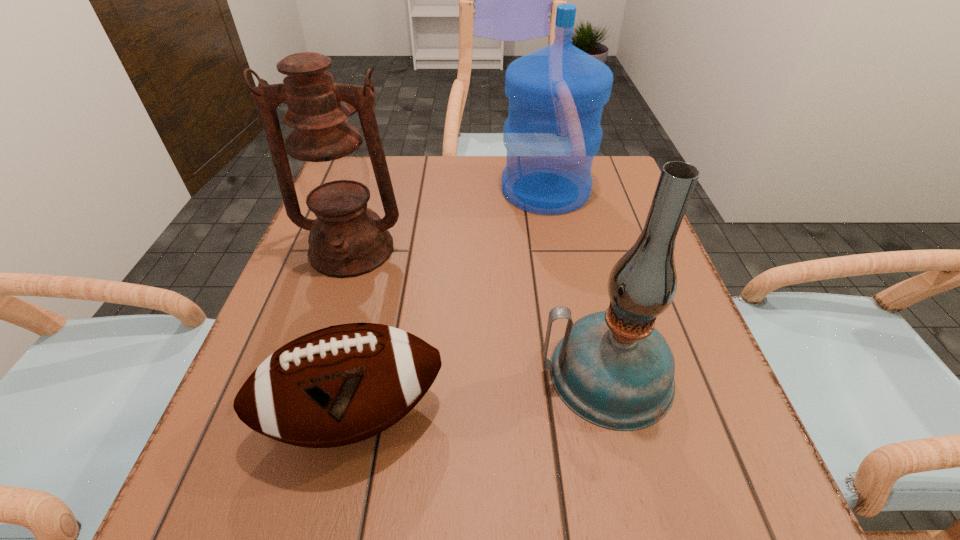
This screenshot has width=960, height=540. Find the location of `object positioned at the near edge`. object positioned at the near edge is located at coordinates (339, 385).

You are a GUI agent. You are given a task and a screenshot of the screen. Output one action in this format:
    pyautogui.click(x=<x>, y=<y>)
    Task: Click on the oil lamp present at the left edge
    
    Given the screenshot: What is the action you would take?
    pyautogui.click(x=347, y=239)

Find the location of `football (American) situated at the left edge`. football (American) situated at the left edge is located at coordinates (339, 385).

At what (x,y) coordinates should I click in order to perform the action: click on water jug located in the right edge section of the desktop. Please return your answer as a coordinate pair (x, y). Looking at the image, I should click on [x=556, y=94].

At what (x,y) coordinates should I click in order to perform the action: click on oil lamp positioned at the right edge. Please return your answer as a coordinate pair (x, y). Looking at the image, I should click on (614, 369).

The height and width of the screenshot is (540, 960). I want to click on object located in the near left corner section of the desktop, so click(339, 385).

Identify the location of object positioned at the far right corner. (556, 94).

Identify the location of free spot at the far edge of the desktop. Image resolution: width=960 pixels, height=540 pixels. (431, 203).

This screenshot has height=540, width=960. I want to click on vacant area at the near edge of the desktop, so click(455, 525).

This screenshot has height=540, width=960. In the image, there is a desktop. In order to click on vacant space at the right edge in this screenshot , I will do `click(687, 437)`.